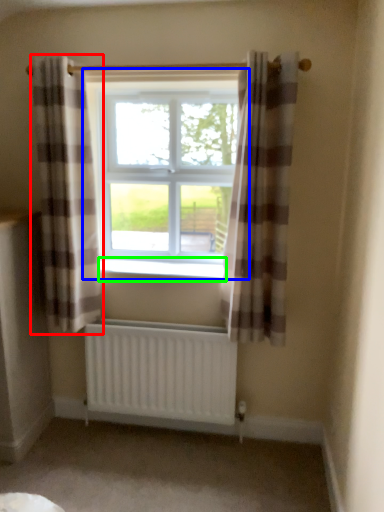
Question: Considering the real-world distances, which object is closest to curtain (highlighted by a red box)? window (highlighted by a blue box) or window sill (highlighted by a green box).

Choices:
 (A) window
 (B) window sill

Answer: (A)